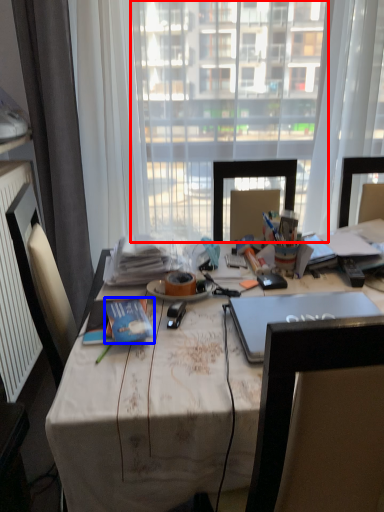
Question: Among these objects, which one is farthest to the camera, window screen (highlighted by a red box) or book (highlighted by a blue box)?

Choices:
 (A) window screen
 (B) book

Answer: (A)